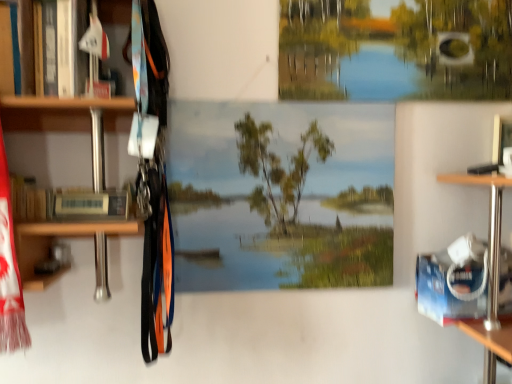
Question: Is smooth canvas mural at center outside hardcover book at left?

Choices:
 (A) no
 (B) yes

Answer: (B)

Question: Considering the relative sizes of smooth canvas mural at center and hardcover book at left in the image provided, is smooth canvas mural at center bigger than hardcover book at left?

Choices:
 (A) yes
 (B) no

Answer: (A)

Question: From the image's perspective, does smooth canvas mural at center appear higher than hardcover book at left?

Choices:
 (A) yes
 (B) no

Answer: (B)

Question: Can you confirm if smooth canvas mural at center is smaller than hardcover book at left?

Choices:
 (A) yes
 (B) no

Answer: (B)

Question: Does smooth canvas mural at center have a greater height compared to hardcover book at left?

Choices:
 (A) yes
 (B) no

Answer: (A)

Question: Relative to smooth canvas mural at center, is hardcover book at left in front or behind?

Choices:
 (A) behind
 (B) front

Answer: (B)

Question: Is hardcover book at left bigger or smaller than smooth canvas mural at center?

Choices:
 (A) small
 (B) big

Answer: (A)

Question: Considering the positions of hardcover book at left and smooth canvas mural at center in the image, is hardcover book at left taller or shorter than smooth canvas mural at center?

Choices:
 (A) short
 (B) tall

Answer: (A)

Question: Considering the positions of hardcover book at left and smooth canvas mural at center in the image, is hardcover book at left wider or thinner than smooth canvas mural at center?

Choices:
 (A) thin
 (B) wide

Answer: (B)

Question: Considering the positions of smooth canvas mural at center and hardcover book at left in the image, is smooth canvas mural at center taller or shorter than hardcover book at left?

Choices:
 (A) tall
 (B) short

Answer: (A)

Question: From the image's perspective, is smooth canvas mural at center above or below hardcover book at left?

Choices:
 (A) below
 (B) above

Answer: (A)

Question: Does point (257, 152) appear closer or farther from the camera than point (99, 216)?

Choices:
 (A) farther
 (B) closer

Answer: (A)

Question: Looking at the image, does smooth canvas mural at center seem bigger or smaller compared to hardcover book at left?

Choices:
 (A) small
 (B) big

Answer: (B)

Question: Does point (458, 72) appear closer or farther from the camera than point (266, 254)?

Choices:
 (A) farther
 (B) closer

Answer: (A)

Question: Visually, is green matte tree at upper center positioned to the left or to the right of smooth canvas mural at center?

Choices:
 (A) right
 (B) left

Answer: (A)